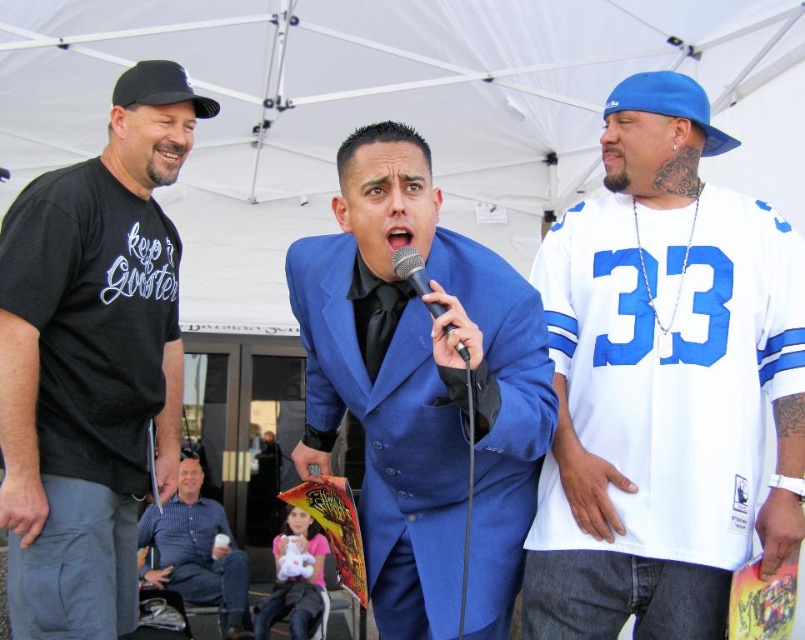
You are organizing a charity event and need to decide which of the two items, the white jersey at right or the blue striped shirt at lower left, can better accommodate a name tag. Based on their sizes, which one would you choose?

The white jersey at right has a larger size compared to the blue striped shirt at lower left, so the white jersey at right can better accommodate a name tag.

You are organizing a stage setup and need to ensure the blue striped shirt at lower left and the black metallic microphone at center fit on a shelf that is 1.2 meters wide. Based on their sizes, will they both fit side by side?

The blue striped shirt at lower left is wider than the black metallic microphone at center. However, without knowing the exact widths of both items, it is impossible to determine if they will fit on the 1.2 meter shelf together.

From the picture: You are a photographer at the event and want to capture a photo that includes both the white jersey at right and the blue striped shirt at lower left. Based on their positions, which one should be placed on the right side of the photo to ensure both are visible?

The white jersey at right should be placed on the right side of the photo because it is already positioned on the right side of the blue striped shirt at lower left in the scene.